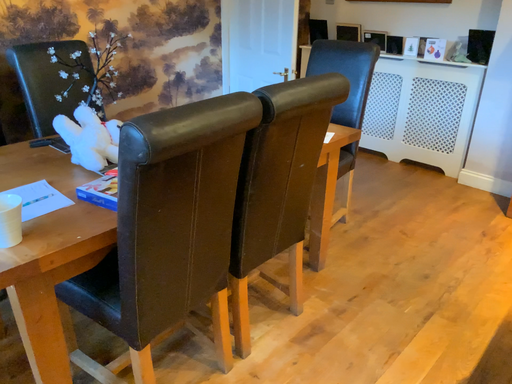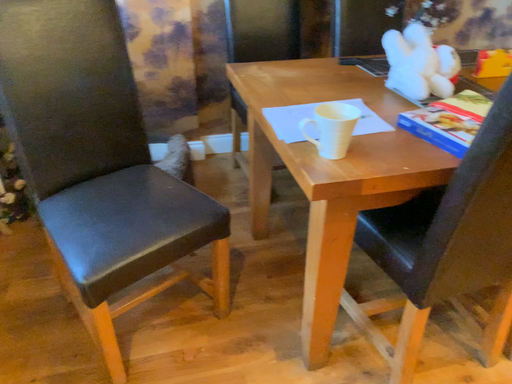
Question: Which way did the camera rotate in the video?

Choices:
 (A) rotated left
 (B) rotated right

Answer: (A)